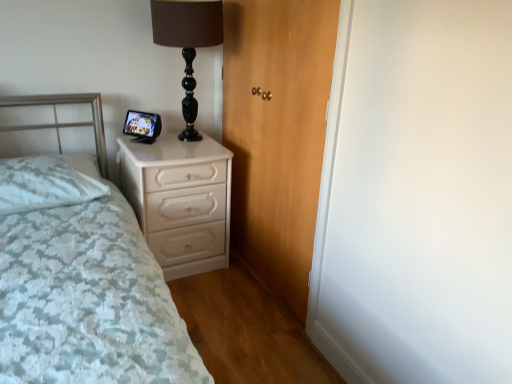
Question: Can you confirm if black glass table lamp at upper center is taller than white textured pillow at left?

Choices:
 (A) no
 (B) yes

Answer: (B)

Question: Is black glass table lamp at upper center shorter than white textured pillow at left?

Choices:
 (A) no
 (B) yes

Answer: (A)

Question: Is white textured pillow at left at the back of black glass table lamp at upper center?

Choices:
 (A) yes
 (B) no

Answer: (B)

Question: Is the position of black glass table lamp at upper center less distant than that of white textured pillow at left?

Choices:
 (A) yes
 (B) no

Answer: (B)

Question: From the image's perspective, is black glass table lamp at upper center below white textured pillow at left?

Choices:
 (A) no
 (B) yes

Answer: (A)

Question: Is the surface of black glass table lamp at upper center in direct contact with white textured pillow at left?

Choices:
 (A) yes
 (B) no

Answer: (B)

Question: Is black glass table lamp at upper center completely or partially outside of white glossy chest of drawers at center?

Choices:
 (A) yes
 (B) no

Answer: (A)

Question: Is white glossy chest of drawers at center surrounded by black glass table lamp at upper center?

Choices:
 (A) no
 (B) yes

Answer: (A)

Question: From the image's perspective, is black glass table lamp at upper center below white glossy chest of drawers at center?

Choices:
 (A) no
 (B) yes

Answer: (A)

Question: Does black glass table lamp at upper center have a greater height compared to white glossy chest of drawers at center?

Choices:
 (A) yes
 (B) no

Answer: (A)

Question: Considering the relative positions of black glass table lamp at upper center and white glossy chest of drawers at center in the image provided, is black glass table lamp at upper center to the left of white glossy chest of drawers at center from the viewer's perspective?

Choices:
 (A) yes
 (B) no

Answer: (B)

Question: Is black glass table lamp at upper center looking in the opposite direction of white glossy chest of drawers at center?

Choices:
 (A) no
 (B) yes

Answer: (A)

Question: Considering the relative sizes of white glossy chest of drawers at center and black glass table lamp at upper center in the image provided, is white glossy chest of drawers at center wider than black glass table lamp at upper center?

Choices:
 (A) yes
 (B) no

Answer: (A)